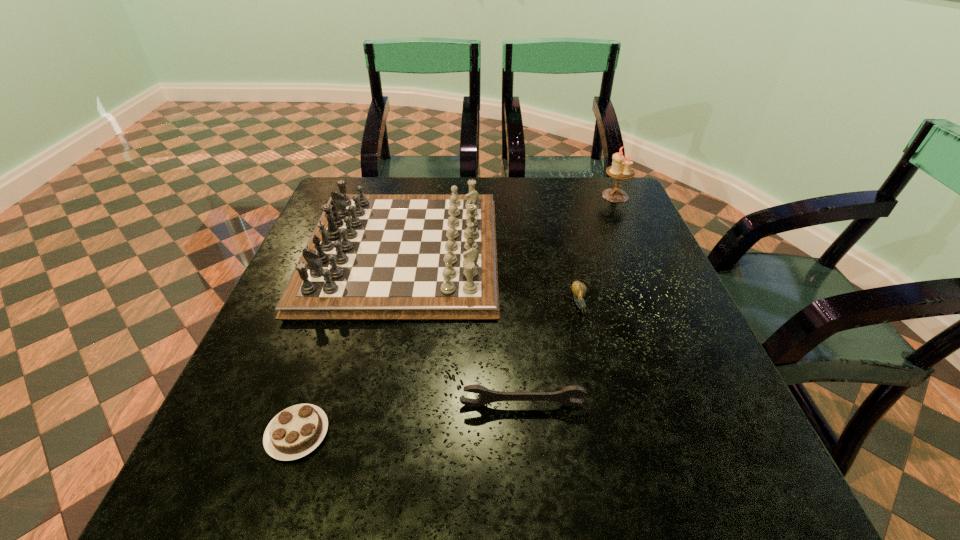
The image size is (960, 540). Identify the location of free space between the chocolate cake and the escargot. (439, 369).

Where is `vacant area that lies between the escargot and the rightmost object`? The width and height of the screenshot is (960, 540). vacant area that lies between the escargot and the rightmost object is located at coordinates (597, 250).

In order to click on blank region between the third shortest object and the fourth shortest object in this screenshot , I will do `click(462, 328)`.

You are a GUI agent. You are given a task and a screenshot of the screen. Output one action in this format:
    pyautogui.click(x=<x>, y=<y>)
    Task: Click on the free point between the rightmost object and the chessboard
    
    Given the screenshot: What is the action you would take?
    pyautogui.click(x=509, y=224)

Locate an element on the screen. This screenshot has width=960, height=540. unoccupied area between the third shortest object and the second shortest object is located at coordinates (551, 354).

This screenshot has height=540, width=960. I want to click on object that stands as the fourth closest to the wrench, so click(x=621, y=169).

Locate which object ranks fourth in proximity to the chocolate cake. Please provide its 2D coordinates. Your answer should be formatted as a tuple, i.e. [(x, y)], where the tuple contains the x and y coordinates of a point satisfying the conditions above.

[(621, 169)]